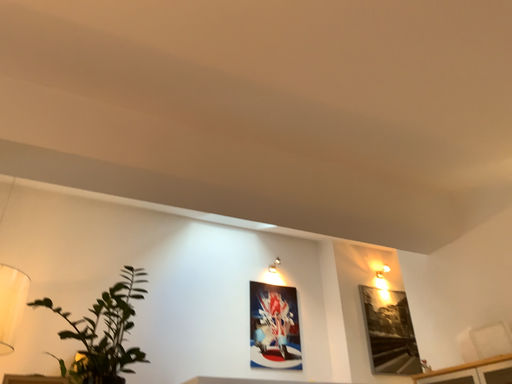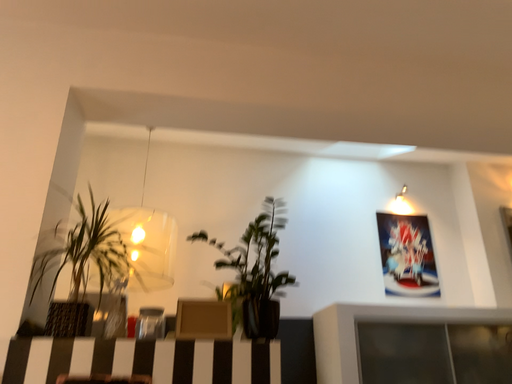
Question: Which way did the camera rotate in the video?

Choices:
 (A) rotated right
 (B) rotated left

Answer: (B)